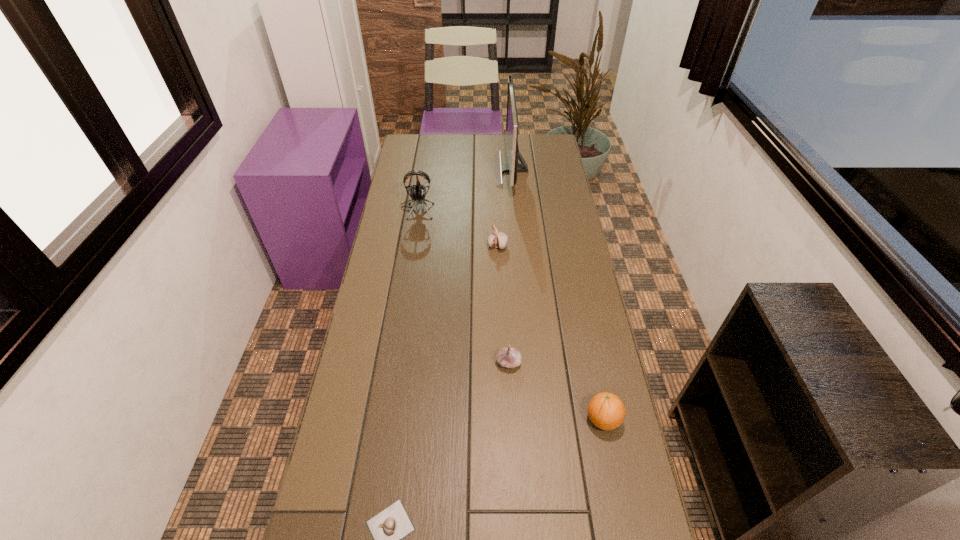
Identify the location of free space located 0.370m on the front of the fourth nearest object. (501, 336).

In order to click on vacant region located 0.100m on the back of the orange in this screenshot , I will do `click(593, 371)`.

The width and height of the screenshot is (960, 540). I want to click on vacant space positioned on the back of the fourth farthest object, so click(507, 336).

Identify the location of object at the far edge. (512, 123).

Find the location of `object at the left edge`. object at the left edge is located at coordinates (418, 192).

Identify the location of monitor that is at the right edge. The width and height of the screenshot is (960, 540). (512, 123).

The image size is (960, 540). I want to click on orange situated at the right edge, so click(606, 411).

Where is `object that is at the far right corner`? object that is at the far right corner is located at coordinates (512, 123).

Locate an element on the screen. The width and height of the screenshot is (960, 540). free spot at the far edge of the desktop is located at coordinates (467, 144).

The width and height of the screenshot is (960, 540). I want to click on vacant space at the left edge, so click(x=394, y=422).